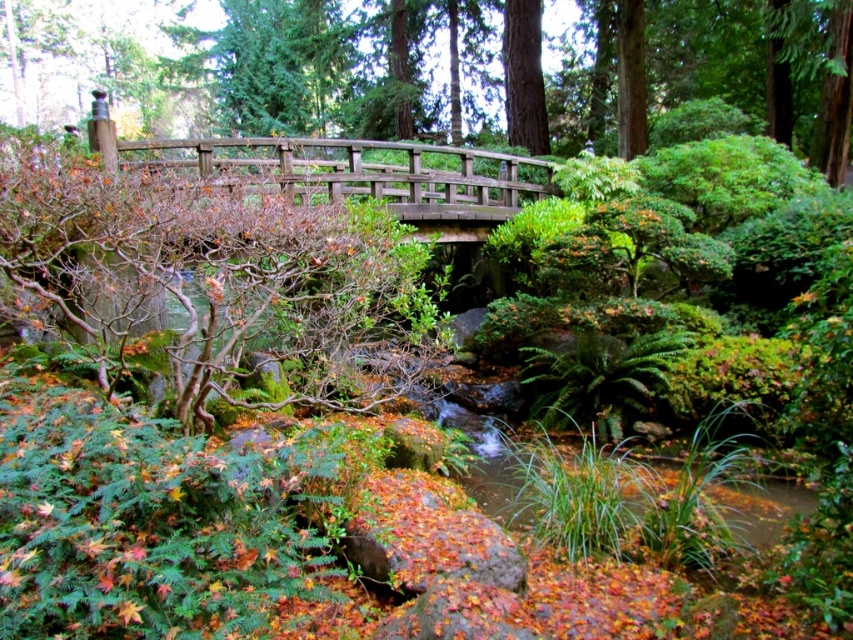
You are a landscape architect designing a new garden and are inspired by this image. You want to ensure that the brown wooden bridge at upper center and the green rough bark tree at upper center are proportionally scaled. Given that the tree is 2 meters wide, what should be the minimum width of the bridge to maintain proper scale?

The brown wooden bridge at upper center is bigger than green rough bark tree at upper center. Since the tree is 2 meters wide, the bridge must be wider than 2 meters to maintain proper scale.

You are a gardener standing at the edge of the garden and want to cross the stream. You see the brown wooden bridge at upper center and the green rough bark tree at upper center. Which object should you approach first to reach the bridge?

You should approach the brown wooden bridge at upper center first because it is located to the left of the green rough bark tree at upper center, making it closer to your current position at the garden edge.

You are standing in the garden and want to walk from the wooden bridge to the tree with bare branches. Which point, point (328,74) or point (531,99), is closer to you as you start walking?

Point (328,74) is closer to you because it is further to the viewer than point (531,99).